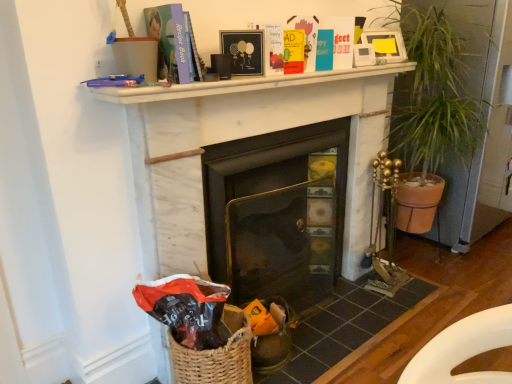
Question: Is there a large distance between yellow matte paperback book at upper center, acting as the 2th paperback book starting from the front, and matte white picture frame at upper right, placed as the 2th picture frame when sorted from bottom to top?

Choices:
 (A) no
 (B) yes

Answer: (A)

Question: Is yellow matte paperback book at upper center, acting as the 2th paperback book starting from the front, thinner than matte white picture frame at upper right, the 1th picture frame viewed from the top?

Choices:
 (A) no
 (B) yes

Answer: (B)

Question: From the image's perspective, is yellow matte paperback book at upper center, positioned as the second paperback book in left-to-right order, located beneath matte white picture frame at upper right, the 2th picture frame from the left?

Choices:
 (A) yes
 (B) no

Answer: (A)

Question: Considering the relative sizes of yellow matte paperback book at upper center, the first paperback book in the back-to-front sequence, and matte white picture frame at upper right, which is counted as the second picture frame, starting from the front, in the image provided, is yellow matte paperback book at upper center, the first paperback book in the back-to-front sequence, shorter than matte white picture frame at upper right, which is counted as the second picture frame, starting from the front,?

Choices:
 (A) no
 (B) yes

Answer: (B)

Question: Does yellow matte paperback book at upper center, the first paperback book positioned from the right, contain matte white picture frame at upper right, the 1th picture frame viewed from the top?

Choices:
 (A) no
 (B) yes

Answer: (A)

Question: Is yellow matte paperback book at upper center, acting as the 2th paperback book starting from the front, in front of matte white picture frame at upper right, which is counted as the 1th picture frame, starting from the back?

Choices:
 (A) no
 (B) yes

Answer: (B)

Question: Is white marble fireplace at center, which appears as the second fireplace when viewed from the left, wider than metallic black fireplace at center, the 2th fireplace viewed from the right?

Choices:
 (A) no
 (B) yes

Answer: (A)

Question: Is the depth of white marble fireplace at center, marked as the 1th fireplace in a right-to-left arrangement, less than that of metallic black fireplace at center, the 2th fireplace viewed from the right?

Choices:
 (A) yes
 (B) no

Answer: (A)

Question: From the image's perspective, is white marble fireplace at center, marked as the 1th fireplace in a right-to-left arrangement, over metallic black fireplace at center, the 2th fireplace viewed from the right?

Choices:
 (A) yes
 (B) no

Answer: (A)

Question: Considering the relative sizes of white marble fireplace at center, marked as the 1th fireplace in a right-to-left arrangement, and metallic black fireplace at center, the 2th fireplace viewed from the right, in the image provided, is white marble fireplace at center, marked as the 1th fireplace in a right-to-left arrangement, bigger than metallic black fireplace at center, the 2th fireplace viewed from the right,?

Choices:
 (A) yes
 (B) no

Answer: (A)

Question: Is white marble fireplace at center, marked as the 1th fireplace in a right-to-left arrangement, surrounding metallic black fireplace at center, the 2th fireplace viewed from the right?

Choices:
 (A) yes
 (B) no

Answer: (A)

Question: From the image's perspective, is white marble fireplace at center, marked as the 1th fireplace in a right-to-left arrangement, located beneath metallic black fireplace at center, the 2th fireplace viewed from the right?

Choices:
 (A) no
 (B) yes

Answer: (A)

Question: Is woven brown basket at lower left directly adjacent to green leafy plant at right?

Choices:
 (A) yes
 (B) no

Answer: (B)